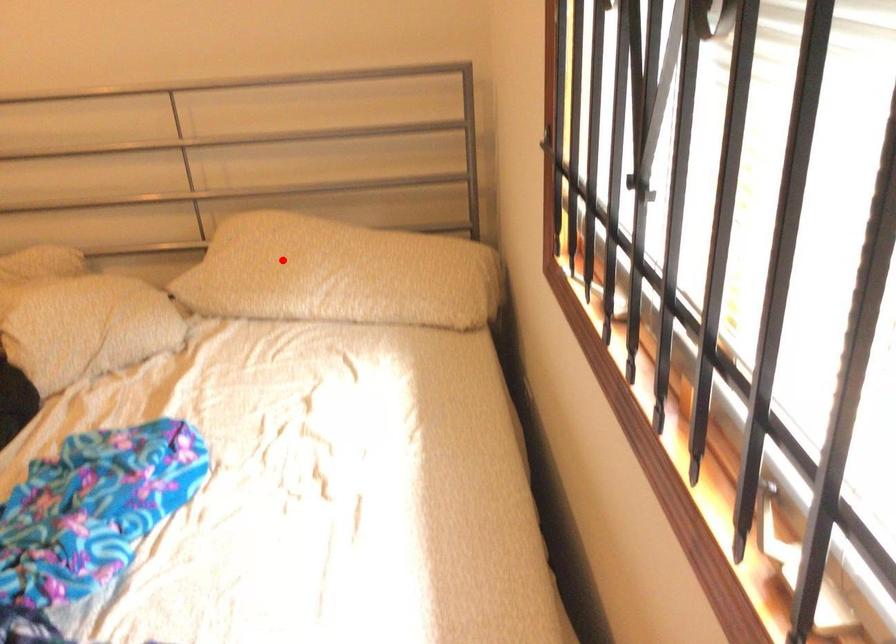
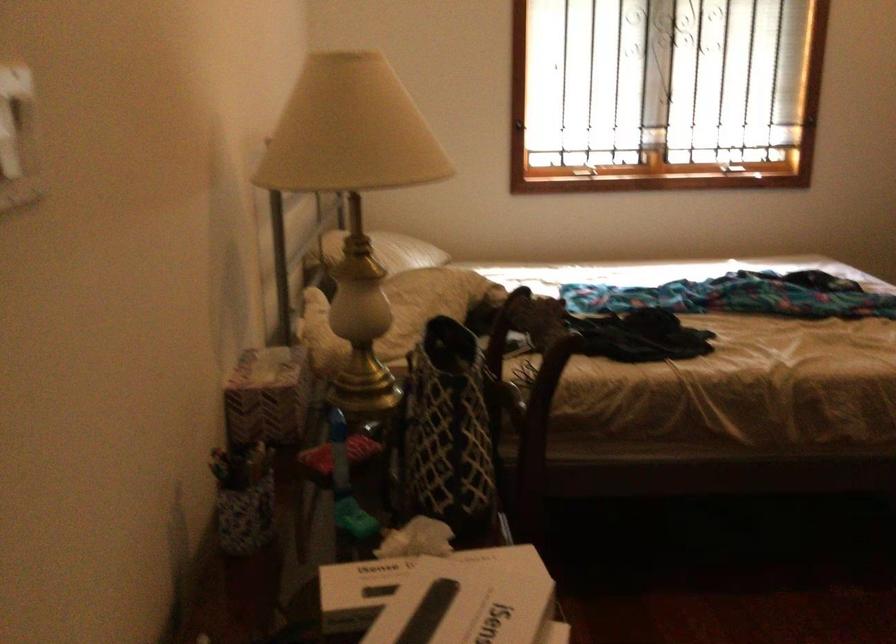
Find the pixel in the second image that matches the highlighted location in the first image.

(388, 251)